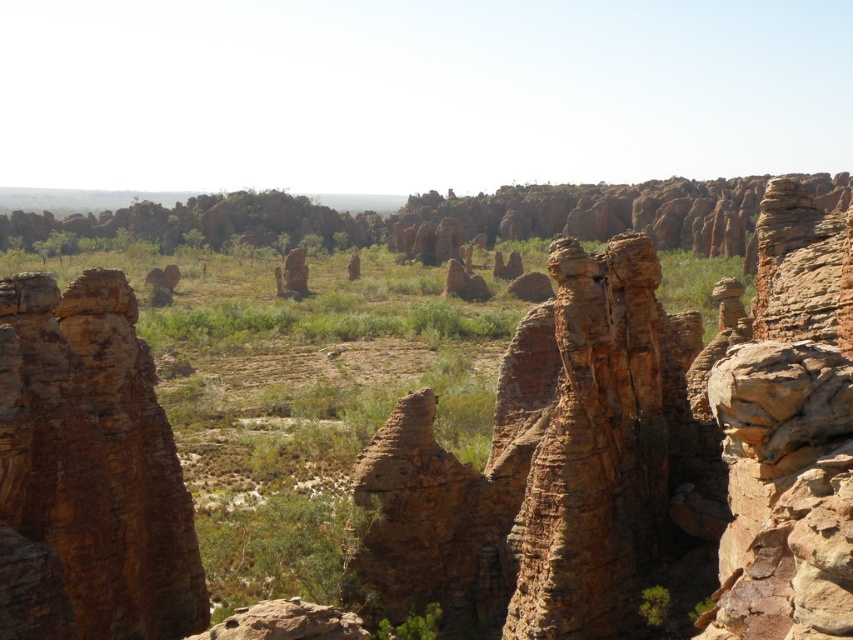
Is green leafy bush at center taller than green leafy shrub at lower center?

Yes.

Measure the distance between point (289, 582) and camera.

77.17 meters

Which is behind, point (274, 524) or point (427, 621)?

The point (274, 524) is more distant.

Where is `green leafy bush at center`? green leafy bush at center is located at coordinates (279, 548).

Based on the photo, which is above, brown rough rock formation at center or green leafy bush at center?

brown rough rock formation at center is higher up.

Which is in front, point (27, 432) or point (344, 529)?

Point (27, 432)

Is point (91, 449) more distant than point (260, 540)?

No.

The width and height of the screenshot is (853, 640). What are the coordinates of `brown rough rock formation at center` in the screenshot? It's located at (88, 472).

From the picture: Is brown rough rock formation at center to the left of green leafy shrub at lower center from the viewer's perspective?

Yes, brown rough rock formation at center is to the left of green leafy shrub at lower center.

Based on the photo, does brown rough rock formation at center have a lesser width compared to green leafy shrub at lower center?

No.

The height and width of the screenshot is (640, 853). What are the coordinates of `brown rough rock formation at center` in the screenshot? It's located at (88, 472).